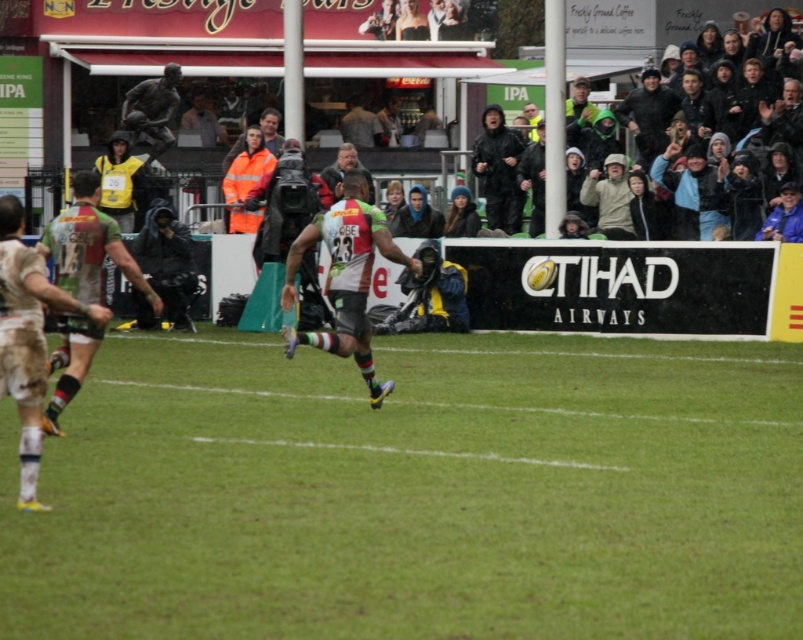
Measure the distance between point [14,209] and camera.

A distance of 32.28 feet exists between point [14,209] and camera.

Measure the distance between camouflage-patterned shorts at left and camera.

The distance of camouflage-patterned shorts at left from camera is 9.27 meters.

Find the location of a particular element. camouflage-patterned shorts at left is located at coordinates (27, 339).

This screenshot has height=640, width=803. I want to click on camouflage-patterned shorts at left, so click(x=27, y=339).

Can you confirm if green grass at center is positioned below camouflage-patterned shorts at center?

Yes.

Does green grass at center have a greater width compared to camouflage-patterned shorts at center?

Yes.

Based on the photo, who is more distant from viewer, (320, 614) or (320, 339)?

Point (320, 339)

This screenshot has height=640, width=803. I want to click on green grass at center, so click(414, 492).

Is green grass at center positioned before camouflage-patterned jersey at left?

Yes, green grass at center is in front of camouflage-patterned jersey at left.

Is green grass at center above camouflage-patterned jersey at left?

Incorrect, green grass at center is not positioned above camouflage-patterned jersey at left.

Is point (160, 426) farther from viewer compared to point (90, 340)?

That is False.

At what (x,y) coordinates should I click in order to perform the action: click on green grass at center. Please return your answer as a coordinate pair (x, y). Looking at the image, I should click on (414, 492).